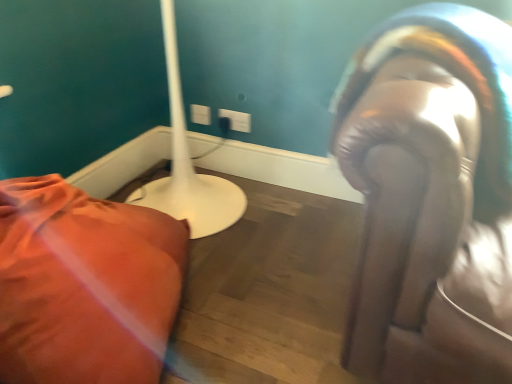
Locate an element on the screen. Image resolution: width=512 pixels, height=384 pixels. white plastic electric outlet at upper center, marked as the second electric outlet in a left-to-right arrangement is located at coordinates (237, 120).

Describe the element at coordinates (200, 114) in the screenshot. The height and width of the screenshot is (384, 512). I see `white plastic electric outlet at upper center, which appears as the 2th electric outlet when viewed from the right` at that location.

Locate an element on the screen. The image size is (512, 384). leather-like glove at right is located at coordinates (430, 196).

In the image, is white plastic electric outlet at upper center, which appears as the first electric outlet when viewed from the left, positioned in front of or behind white plastic electric outlet at upper center, marked as the second electric outlet in a left-to-right arrangement?

white plastic electric outlet at upper center, which appears as the first electric outlet when viewed from the left, is positioned farther from the viewer than white plastic electric outlet at upper center, marked as the second electric outlet in a left-to-right arrangement.

Can you confirm if white plastic electric outlet at upper center, which appears as the first electric outlet when viewed from the left, is thinner than white plastic electric outlet at upper center, which appears as the 1th electric outlet when viewed from the right?

In fact, white plastic electric outlet at upper center, which appears as the first electric outlet when viewed from the left, might be wider than white plastic electric outlet at upper center, which appears as the 1th electric outlet when viewed from the right.

Does white plastic electric outlet at upper center, which appears as the first electric outlet when viewed from the left, have a lesser height compared to white plastic electric outlet at upper center, which appears as the 1th electric outlet when viewed from the right?

No.

Can you tell me how much white plastic electric outlet at upper center, which appears as the first electric outlet when viewed from the left, and white plastic electric outlet at upper center, marked as the second electric outlet in a left-to-right arrangement, differ in facing direction?

The facing directions of white plastic electric outlet at upper center, which appears as the first electric outlet when viewed from the left, and white plastic electric outlet at upper center, marked as the second electric outlet in a left-to-right arrangement, are 0 degrees apart.

Do you think white plastic electric outlet at upper center, marked as the second electric outlet in a left-to-right arrangement, is within matte white lamp at left, or outside of it?

white plastic electric outlet at upper center, marked as the second electric outlet in a left-to-right arrangement, is outside matte white lamp at left.

From the image's perspective, is white plastic electric outlet at upper center, marked as the second electric outlet in a left-to-right arrangement, located above or below matte white lamp at left?

Based on their image positions, white plastic electric outlet at upper center, marked as the second electric outlet in a left-to-right arrangement, is located above matte white lamp at left.

This screenshot has height=384, width=512. I want to click on furniture in front of the white plastic electric outlet at upper center, marked as the second electric outlet in a left-to-right arrangement, so click(x=84, y=285).

Is white plastic electric outlet at upper center, marked as the second electric outlet in a left-to-right arrangement, bigger or smaller than matte white lamp at left?

Considering their sizes, white plastic electric outlet at upper center, marked as the second electric outlet in a left-to-right arrangement, takes up less space than matte white lamp at left.

Is leather-like glove at right positioned beyond the bounds of white plastic electric outlet at upper center, which appears as the first electric outlet when viewed from the left?

Indeed, leather-like glove at right is completely outside white plastic electric outlet at upper center, which appears as the first electric outlet when viewed from the left.

Locate an element on the screen. electric outlet that is the 2nd one when counting upward from the leather-like glove at right (from the image's perspective) is located at coordinates (x=200, y=114).

Is leather-like glove at right far from white plastic electric outlet at upper center, which appears as the 2th electric outlet when viewed from the right?

Indeed, leather-like glove at right is not near white plastic electric outlet at upper center, which appears as the 2th electric outlet when viewed from the right.

Are white plastic electric outlet at upper center, marked as the second electric outlet in a left-to-right arrangement, and white plastic electric outlet at upper center, which appears as the 2th electric outlet when viewed from the right, located far from each other?

No.

Is white plastic electric outlet at upper center, marked as the second electric outlet in a left-to-right arrangement, at the right side of white plastic electric outlet at upper center, which appears as the first electric outlet when viewed from the left?

Yes, white plastic electric outlet at upper center, marked as the second electric outlet in a left-to-right arrangement, is to the right of white plastic electric outlet at upper center, which appears as the first electric outlet when viewed from the left.

Who is taller, white plastic electric outlet at upper center, marked as the second electric outlet in a left-to-right arrangement, or white plastic electric outlet at upper center, which appears as the first electric outlet when viewed from the left?

Standing taller between the two is white plastic electric outlet at upper center, which appears as the first electric outlet when viewed from the left.

Is point (242, 120) positioned in front of point (208, 110)?

Yes, it is.

Can you confirm if leather-like glove at right is thinner than matte white lamp at left?

Correct, the width of leather-like glove at right is less than that of matte white lamp at left.

From a real-world perspective, between leather-like glove at right and matte white lamp at left, who is vertically higher?

In real-world perspective, leather-like glove at right is above.

Is leather-like glove at right smaller than matte white lamp at left?

Incorrect, leather-like glove at right is not smaller in size than matte white lamp at left.

Between leather-like glove at right and matte white lamp at left, which one is positioned in front?

Positioned in front is matte white lamp at left.

Is point (246, 117) farther from viewer compared to point (423, 240)?

Yes, it is behind point (423, 240).

From a real-world perspective, is white plastic electric outlet at upper center, which appears as the 1th electric outlet when viewed from the right, on top of leather-like glove at right?

No.

Do you think white plastic electric outlet at upper center, marked as the second electric outlet in a left-to-right arrangement, is within leather-like glove at right, or outside of it?

white plastic electric outlet at upper center, marked as the second electric outlet in a left-to-right arrangement, cannot be found inside leather-like glove at right.

Can you confirm if white plastic electric outlet at upper center, marked as the second electric outlet in a left-to-right arrangement, is shorter than leather-like glove at right?

Yes.

How different are the orientations of white plastic electric outlet at upper center, which appears as the first electric outlet when viewed from the left, and matte white lamp at left in degrees?

white plastic electric outlet at upper center, which appears as the first electric outlet when viewed from the left, and matte white lamp at left are facing 89.7 degrees away from each other.

Where is `the 2nd electric outlet above the matte white lamp at left (from the image's perspective)`? The width and height of the screenshot is (512, 384). the 2nd electric outlet above the matte white lamp at left (from the image's perspective) is located at coordinates (200, 114).

Would you say white plastic electric outlet at upper center, which appears as the first electric outlet when viewed from the left, is outside matte white lamp at left?

That's correct, white plastic electric outlet at upper center, which appears as the first electric outlet when viewed from the left, is outside of matte white lamp at left.

You are a GUI agent. You are given a task and a screenshot of the screen. Output one action in this format:
    pyautogui.click(x=<x>, y=<y>)
    Task: Click on the electric outlet above the white plastic electric outlet at upper center, marked as the second electric outlet in a left-to-right arrangement (from a real-world perspective)
    This screenshot has height=384, width=512.
    Given the screenshot: What is the action you would take?
    pyautogui.click(x=200, y=114)

I want to click on furniture below the white plastic electric outlet at upper center, marked as the second electric outlet in a left-to-right arrangement (from the image's perspective), so click(84, 285).

Considering their positions, is white plastic electric outlet at upper center, marked as the second electric outlet in a left-to-right arrangement, positioned further to matte white lamp at left than white plastic electric outlet at upper center, which appears as the 2th electric outlet when viewed from the right?

white plastic electric outlet at upper center, which appears as the 2th electric outlet when viewed from the right, is positioned further to the anchor matte white lamp at left.

From the image, which object appears to be farther from matte white lamp at left, white plastic electric outlet at upper center, which appears as the 2th electric outlet when viewed from the right, or leather-like glove at right?

white plastic electric outlet at upper center, which appears as the 2th electric outlet when viewed from the right, lies further to matte white lamp at left than the other object.

Which object lies further to the anchor point white plastic electric outlet at upper center, which appears as the first electric outlet when viewed from the left, matte white lamp at left or leather-like glove at right?

leather-like glove at right is further to white plastic electric outlet at upper center, which appears as the first electric outlet when viewed from the left.

Which object lies nearer to the anchor point white plastic electric outlet at upper center, which appears as the 1th electric outlet when viewed from the right, white plastic electric outlet at upper center, which appears as the first electric outlet when viewed from the left, or matte white lamp at left?

The object closer to white plastic electric outlet at upper center, which appears as the 1th electric outlet when viewed from the right, is white plastic electric outlet at upper center, which appears as the first electric outlet when viewed from the left.

In the scene shown: Which object lies further to the anchor point leather-like glove at right, matte white lamp at left or white plastic electric outlet at upper center, which appears as the first electric outlet when viewed from the left?

white plastic electric outlet at upper center, which appears as the first electric outlet when viewed from the left, is further to leather-like glove at right.

When comparing their distances from leather-like glove at right, does white plastic electric outlet at upper center, which appears as the 2th electric outlet when viewed from the right, or white plastic electric outlet at upper center, marked as the second electric outlet in a left-to-right arrangement, seem closer?

Among the two, white plastic electric outlet at upper center, marked as the second electric outlet in a left-to-right arrangement, is located nearer to leather-like glove at right.

Looking at the image, which one is located further to white plastic electric outlet at upper center, marked as the second electric outlet in a left-to-right arrangement, white plastic electric outlet at upper center, which appears as the first electric outlet when viewed from the left, or leather-like glove at right?

Based on the image, leather-like glove at right appears to be further to white plastic electric outlet at upper center, marked as the second electric outlet in a left-to-right arrangement.

Looking at the image, which one is located further to white plastic electric outlet at upper center, marked as the second electric outlet in a left-to-right arrangement, matte white lamp at left or leather-like glove at right?

The object further to white plastic electric outlet at upper center, marked as the second electric outlet in a left-to-right arrangement, is leather-like glove at right.

Image resolution: width=512 pixels, height=384 pixels. Find the location of `person between matte white lamp at left and white plastic electric outlet at upper center, which appears as the 2th electric outlet when viewed from the right, in the front-back direction`. person between matte white lamp at left and white plastic electric outlet at upper center, which appears as the 2th electric outlet when viewed from the right, in the front-back direction is located at coordinates (430, 196).

Locate an element on the screen. This screenshot has height=384, width=512. person between matte white lamp at left and white plastic electric outlet at upper center, which appears as the 1th electric outlet when viewed from the right, along the z-axis is located at coordinates (430, 196).

What are the coordinates of `electric outlet located between leather-like glove at right and white plastic electric outlet at upper center, which appears as the 2th electric outlet when viewed from the right, in the depth direction` in the screenshot? It's located at (237, 120).

Identify the location of electric outlet between matte white lamp at left and white plastic electric outlet at upper center, which appears as the first electric outlet when viewed from the left, from front to back. The height and width of the screenshot is (384, 512). (237, 120).